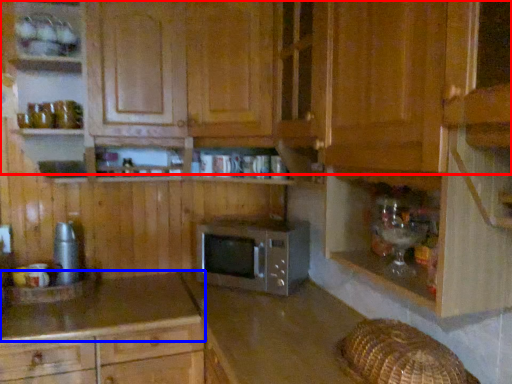
Question: Which object is further to the camera taking this photo, cabinetry (highlighted by a red box) or countertop (highlighted by a blue box)?

Choices:
 (A) cabinetry
 (B) countertop

Answer: (B)